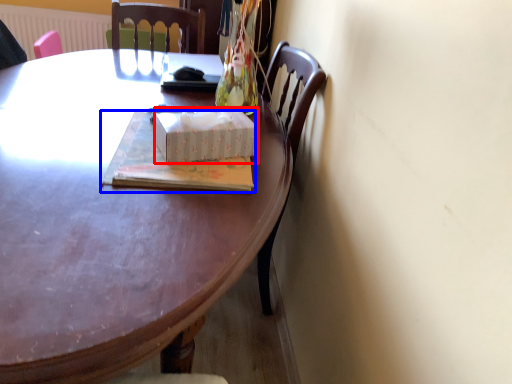
Question: Which point is closer to the camera, box (highlighted by a red box) or book (highlighted by a blue box)?

Choices:
 (A) box
 (B) book

Answer: (B)